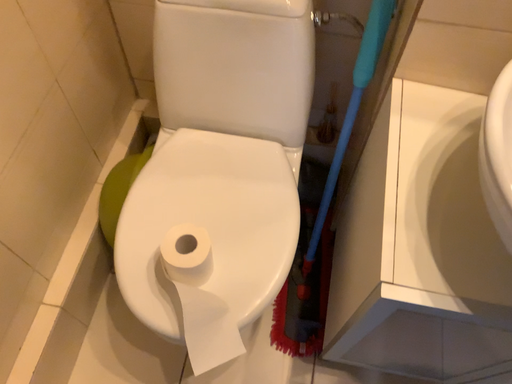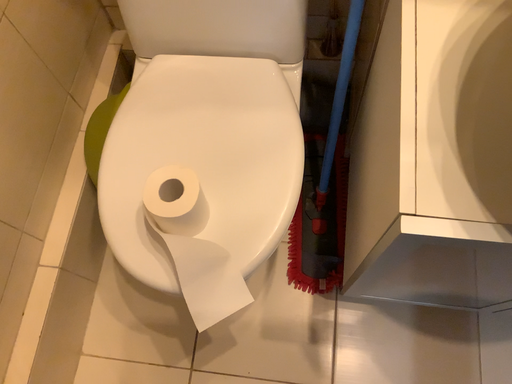
Question: How did the camera likely rotate when shooting the video?

Choices:
 (A) rotated upward
 (B) rotated downward

Answer: (B)